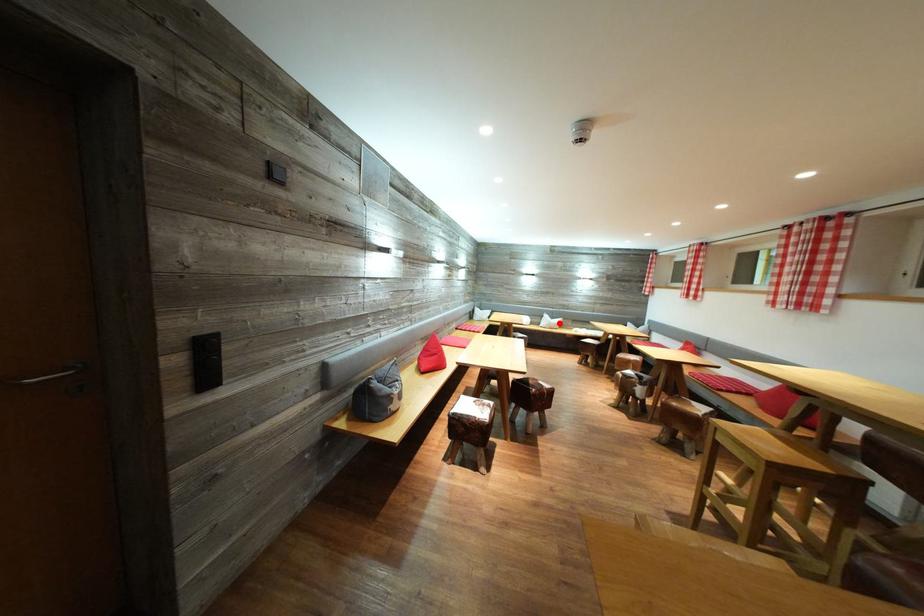
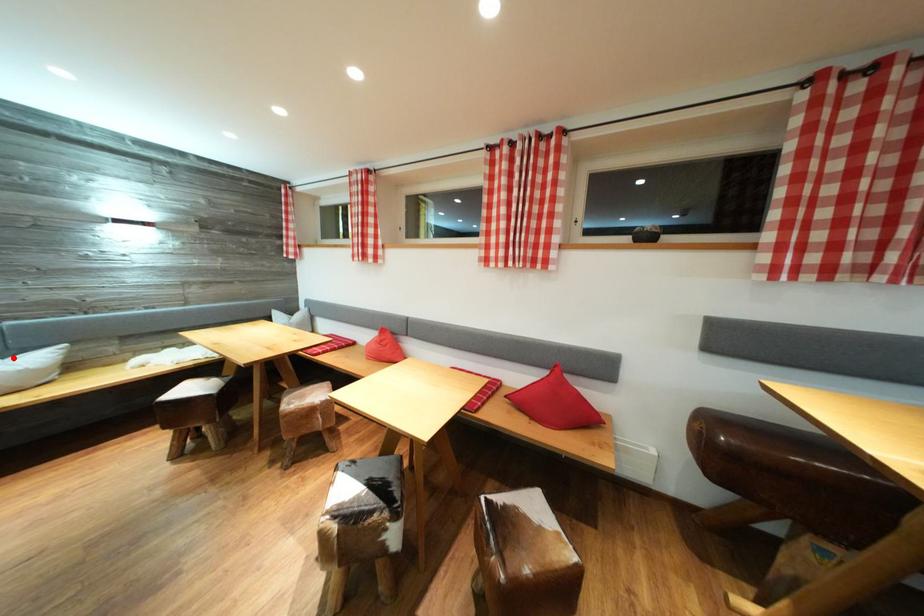
I am providing you with two images of the same scene from different viewpoints. A red point is marked on the first image and another point is marked on the second image. Do the highlighted points in image1 and image2 indicate the same real-world spot?

Yes